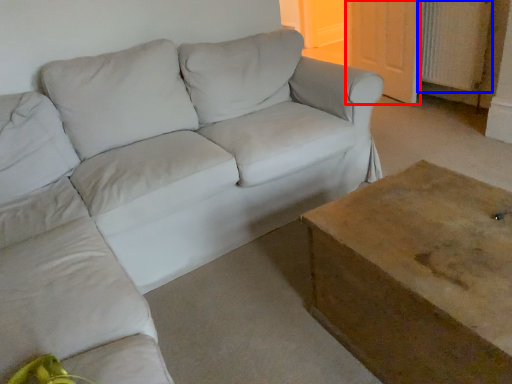
Question: Among these objects, which one is farthest to the camera, door (highlighted by a red box) or radiator (highlighted by a blue box)?

Choices:
 (A) door
 (B) radiator

Answer: (A)